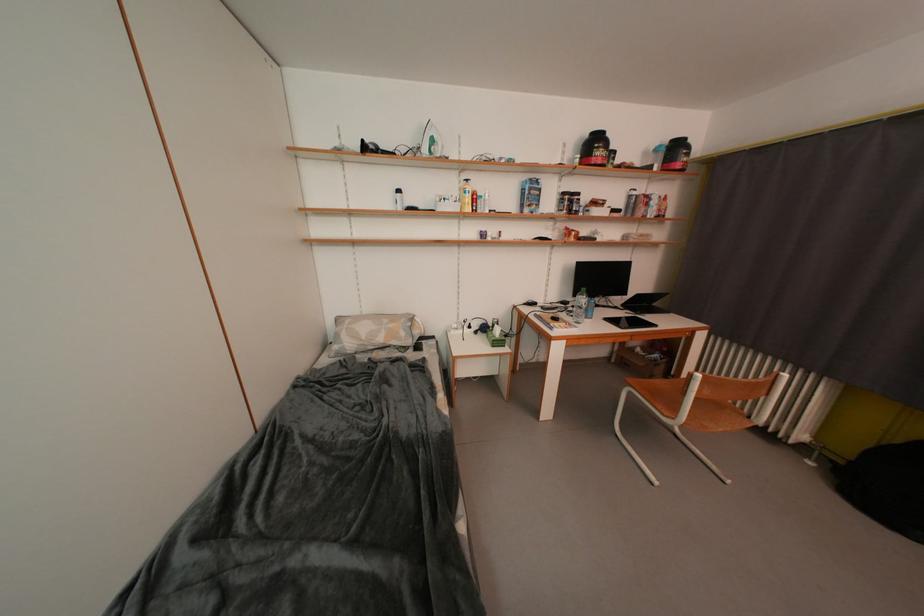
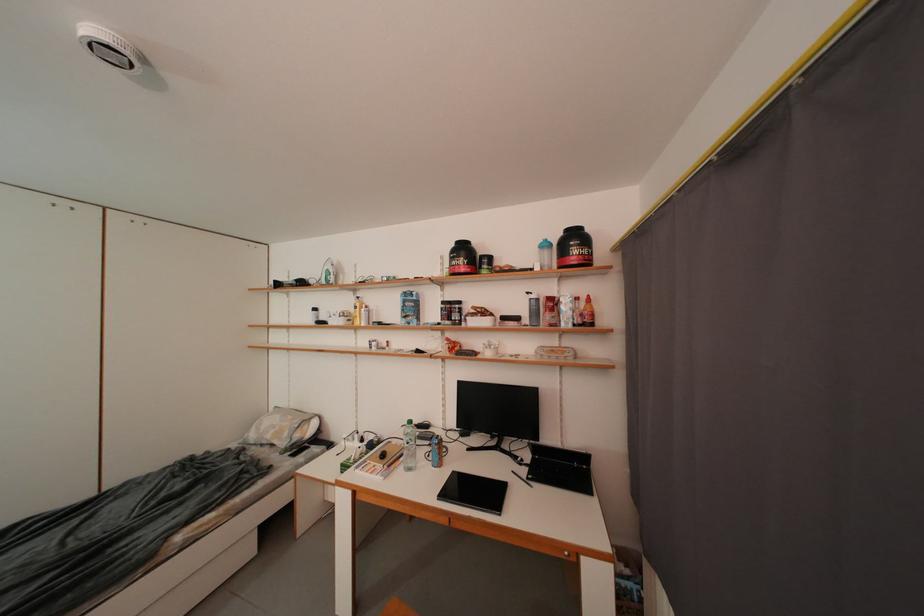
In the second image, find the point that corresponds to [666,213] in the first image.

(590, 318)